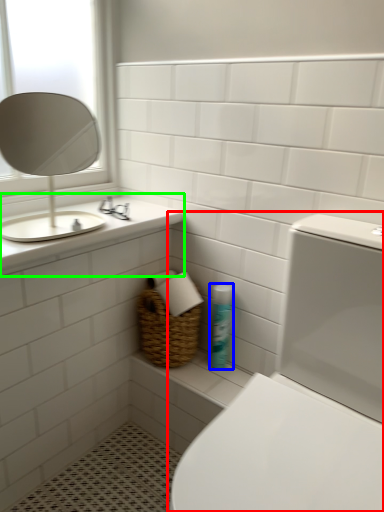
Question: Which is nearer to the toilet (highlighted by a red box)? cleaning product (highlighted by a blue box) or counter top (highlighted by a green box).

Choices:
 (A) cleaning product
 (B) counter top

Answer: (A)